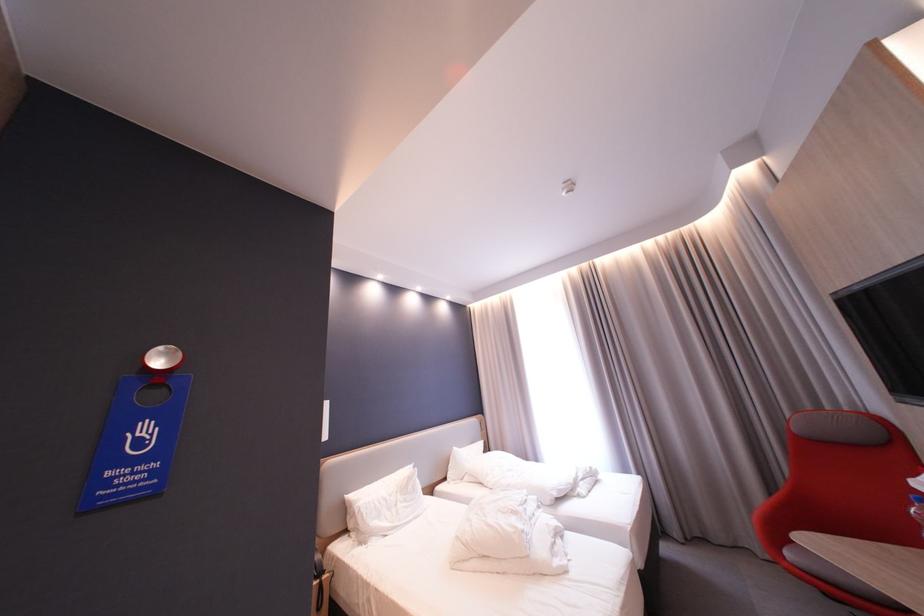
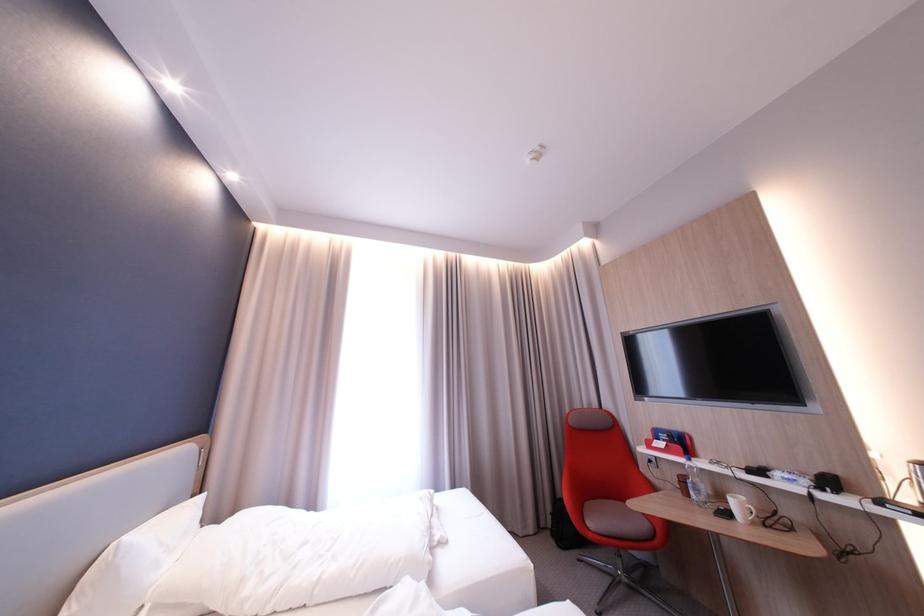
Find the pixel in the second image that matches point 796,557 in the first image.

(600, 529)